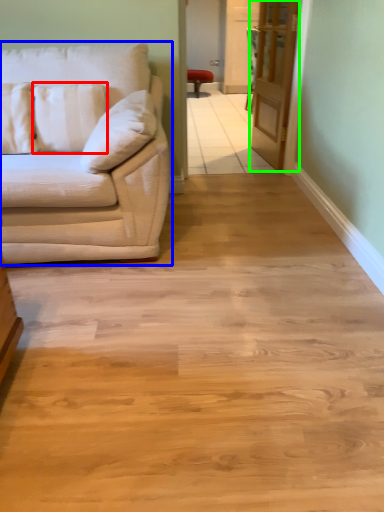
Question: Based on their relative distances, which object is nearer to pillow (highlighted by a red box)? Choose from studio couch (highlighted by a blue box) and glass door (highlighted by a green box).

Choices:
 (A) studio couch
 (B) glass door

Answer: (A)